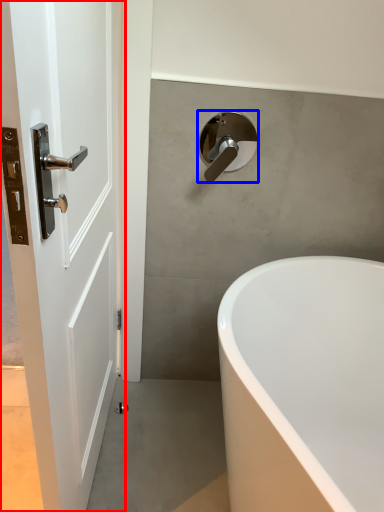
Question: Which object is further to the camera taking this photo, door (highlighted by a red box) or tap (highlighted by a blue box)?

Choices:
 (A) door
 (B) tap

Answer: (B)